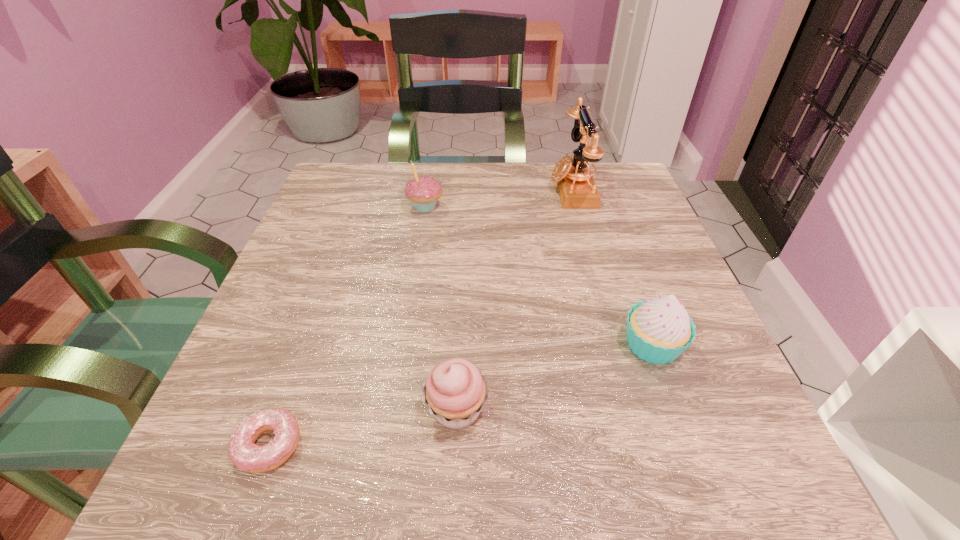
Where is `object that is at the left edge`? object that is at the left edge is located at coordinates (243, 452).

This screenshot has width=960, height=540. I want to click on telephone located at the right edge, so click(x=577, y=190).

The width and height of the screenshot is (960, 540). What are the coordinates of `cupcake positioned at the right edge` in the screenshot? It's located at (659, 330).

Where is `object that is at the near left corner`? Image resolution: width=960 pixels, height=540 pixels. object that is at the near left corner is located at coordinates (243, 452).

Locate an element on the screen. This screenshot has height=540, width=960. object at the far right corner is located at coordinates (577, 190).

The image size is (960, 540). Find the location of `vacant space at the far edge of the desktop`. vacant space at the far edge of the desktop is located at coordinates (504, 191).

Locate an element on the screen. The image size is (960, 540). free space at the near edge of the desktop is located at coordinates (326, 438).

Where is `vacant position at the left edge of the desktop`? This screenshot has height=540, width=960. vacant position at the left edge of the desktop is located at coordinates (379, 224).

This screenshot has height=540, width=960. I want to click on vacant region at the right edge of the desktop, so click(643, 219).

Locate an element on the screen. Image resolution: width=960 pixels, height=540 pixels. free space at the far left corner of the desktop is located at coordinates (357, 190).